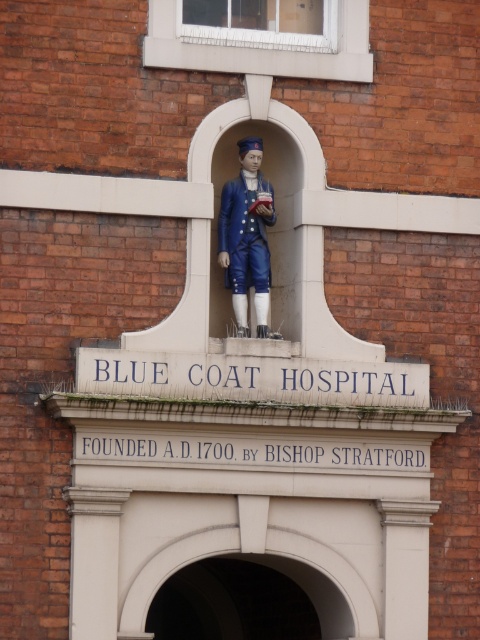
You are standing at the entrance of the Blue Coat Hospital and want to locate the white stone arch at center. According to the architectural layout, where should you look in terms of direction and position?

The white stone arch at center is positioned within the central focus of the entrance, framed by the recessed alcove above the statue of a young boy in a blue coat. It is centrally located at the entrance, directly in front of you if you are facing the hospital facade.

You are standing at the entrance of the Blue Coat Hospital and want to take a photo of the statue of the boy in the blue coat. You notice two points on the statue labeled as point 1 and point 2. If point 1 is at coordinate (x=226, y=596) and point 2 is at (x=244, y=241), which point is closer to your camera when taking the photo?

Point 1 at coordinate (x=226, y=596) is closer to the camera than point 2 at (x=244, y=241) because it is further to the camera than the other point.

You are a painter hired to paint the entrance of the Blue Coat Hospital. You need to ensure that the white stone arch at center is wider than the matte blue uniform at center. Is this already the case?

The white stone arch at center is wider than the matte blue uniform at center according to the description.